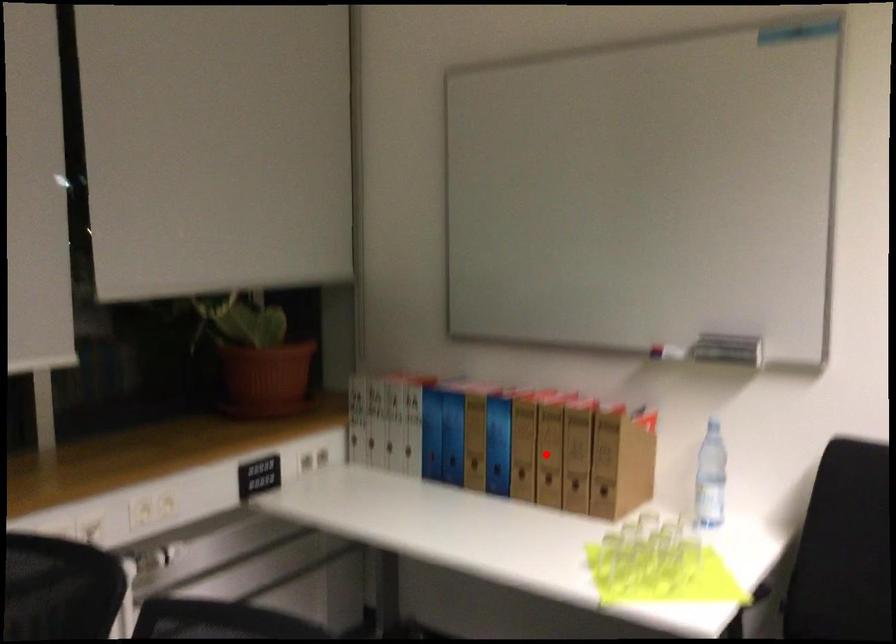
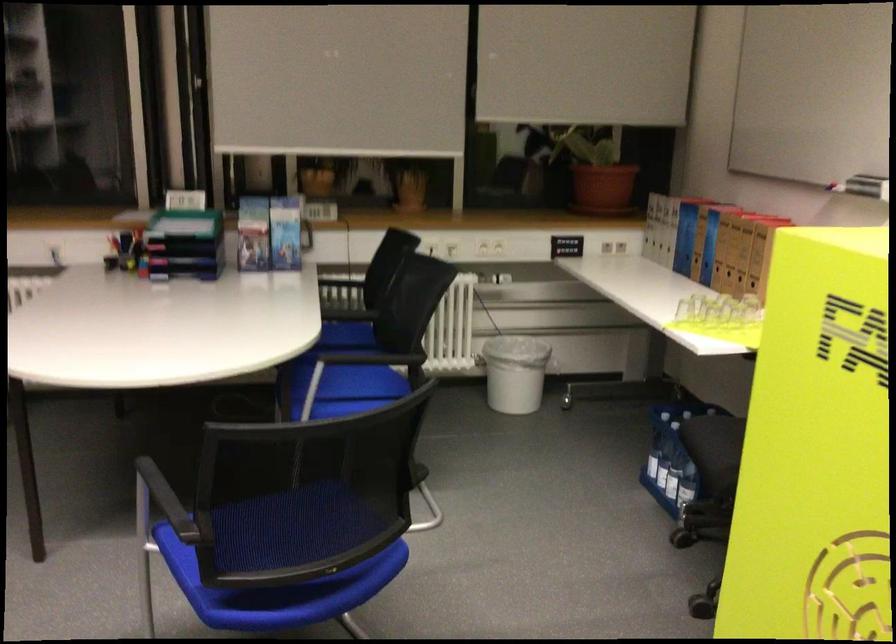
Question: I am providing you with two images of the same scene from different viewpoints. In image1, a red point is highlighted. Considering the same 3D point in image2, which of the following is correct?

Choices:
 (A) It is closer
 (B) It is farther

Answer: (B)